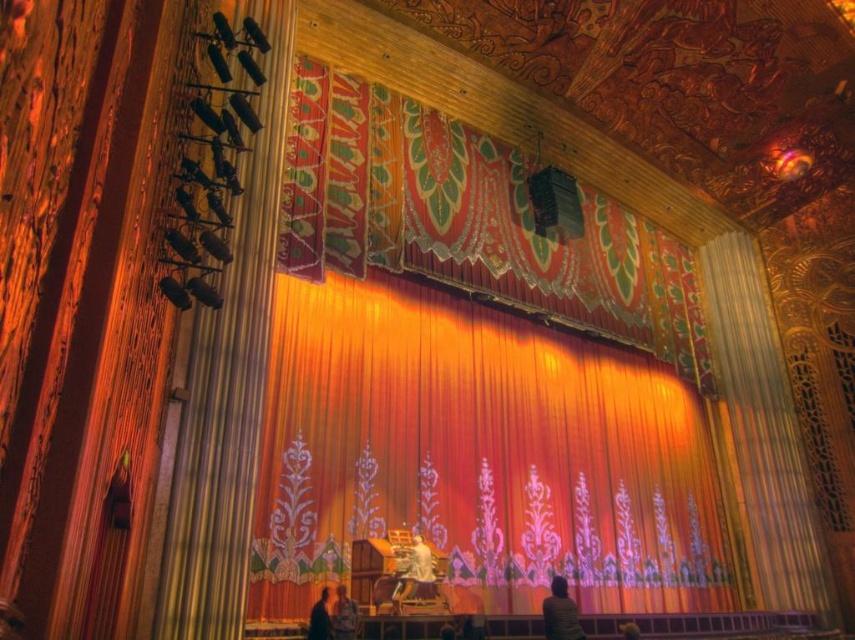
Which of these two, smooth beige shirt at lower center or dark brown leather jacket at lower center, stands taller?

Standing taller between the two is dark brown leather jacket at lower center.

Between smooth beige shirt at lower center and dark brown leather jacket at lower center, which one has less height?

smooth beige shirt at lower center

This screenshot has height=640, width=855. Identify the location of smooth beige shirt at lower center. (343, 616).

I want to click on smooth beige shirt at lower center, so click(343, 616).

Does smooth white shirt at lower center have a greater height compared to smooth beige shirt at lower center?

Correct, smooth white shirt at lower center is much taller as smooth beige shirt at lower center.

Can you confirm if smooth white shirt at lower center is bigger than smooth beige shirt at lower center?

Indeed, smooth white shirt at lower center has a larger size compared to smooth beige shirt at lower center.

Find the location of a particular element. The height and width of the screenshot is (640, 855). smooth white shirt at lower center is located at coordinates (559, 612).

Identify the location of smooth white shirt at lower center. (559, 612).

Can you confirm if gold textured curtain at right is positioned above smooth white shirt at lower center?

Yes.

Is point (782, 552) closer to viewer compared to point (573, 627)?

No, it is not.

Locate an element on the screen. gold textured curtain at right is located at coordinates (764, 432).